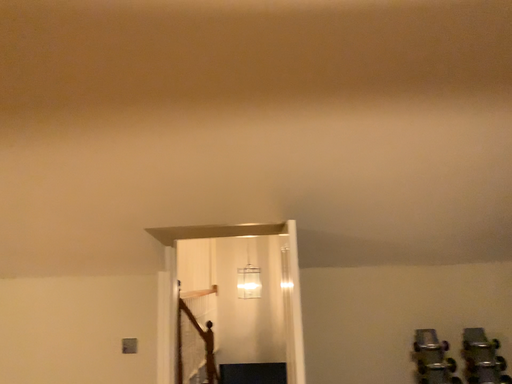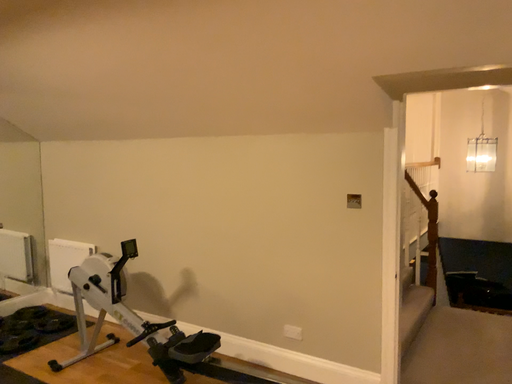
Question: Which way did the camera rotate in the video?

Choices:
 (A) rotated upward
 (B) rotated downward

Answer: (B)